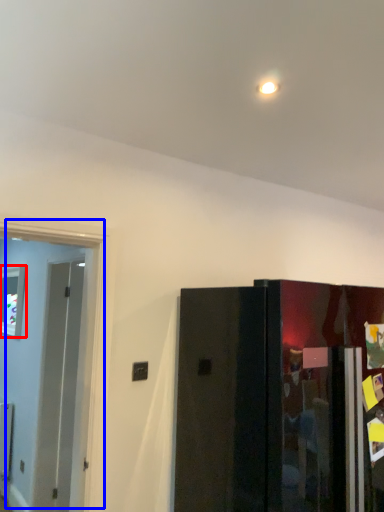
Question: Which of the following is the farthest to the observer, window (highlighted by a red box) or door (highlighted by a blue box)?

Choices:
 (A) window
 (B) door

Answer: (A)